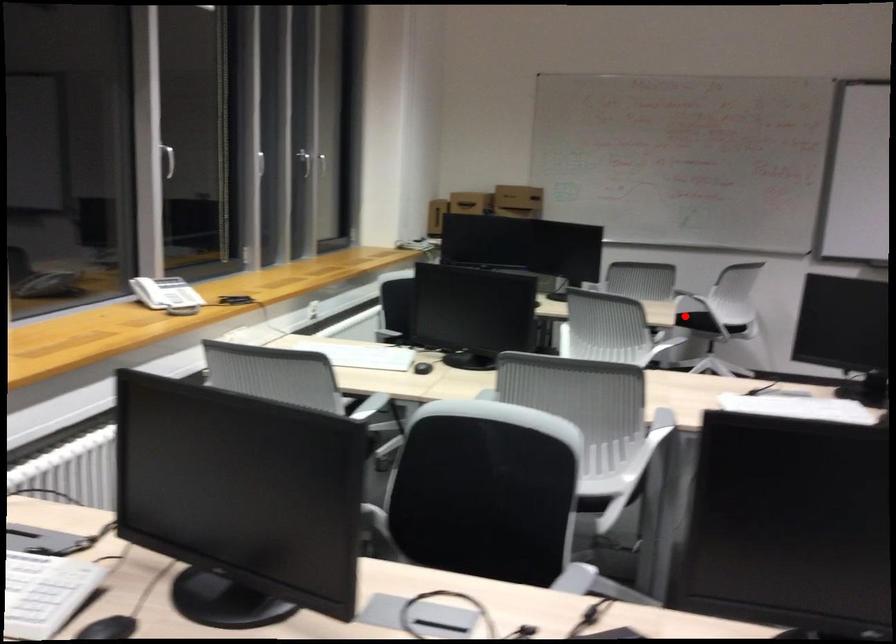
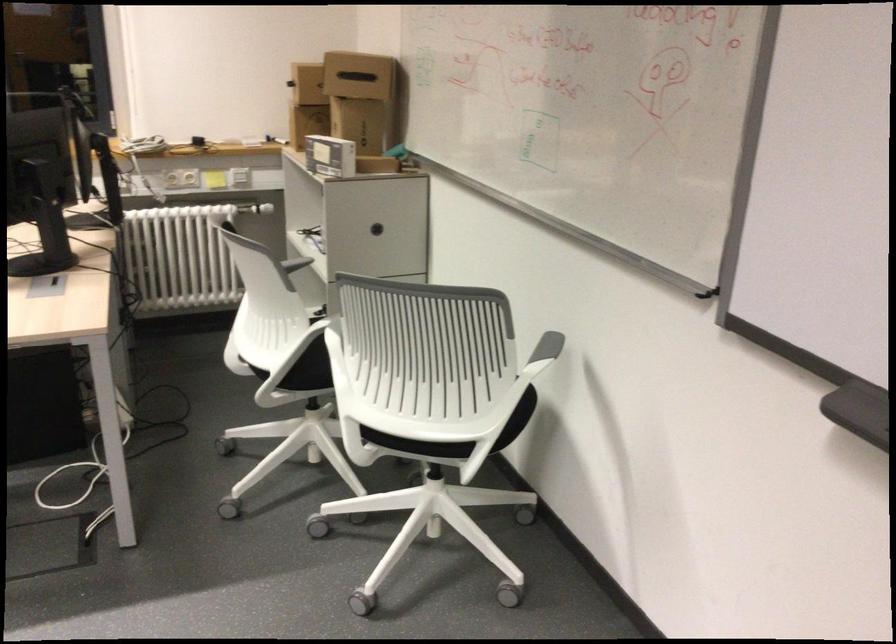
Locate, in the second image, the point that corresponds to the highlighted location in the first image.

(307, 375)